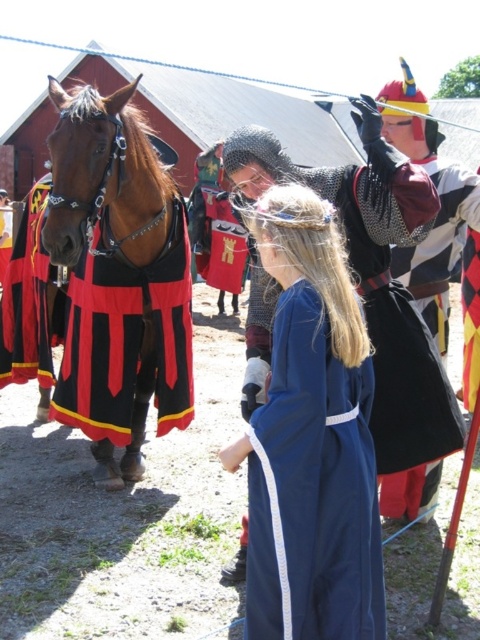
Question: Which of the following is the farthest from the observer?

Choices:
 (A) (171, 346)
 (B) (264, 148)
 (C) (276, 509)

Answer: (A)

Question: Estimate the real-world distances between objects in this image. Which object is farther from the blue satin dress at center?

Choices:
 (A) shiny brown horse at left
 (B) chainmail armor at center

Answer: (A)

Question: Is blue satin dress at center above chainmail armor at center?

Choices:
 (A) no
 (B) yes

Answer: (A)

Question: Among these points, which one is farthest from the camera?

Choices:
 (A) (372, 189)
 (B) (277, 188)

Answer: (A)

Question: Can you confirm if blue satin dress at center is positioned below shiny brown horse at left?

Choices:
 (A) no
 (B) yes

Answer: (B)

Question: Does blue satin dress at center have a smaller size compared to shiny brown horse at left?

Choices:
 (A) no
 (B) yes

Answer: (B)